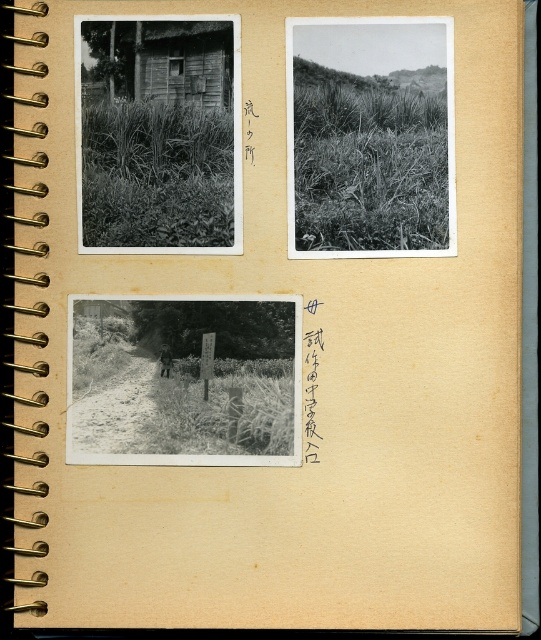
Question: Does grassy textured field at bottom center appear over wooden hut at upper left?

Choices:
 (A) no
 (B) yes

Answer: (A)

Question: Which of the following is the closest to the observer?

Choices:
 (A) grassy vegetation at upper left
 (B) grassy textured field at bottom center
 (C) wooden hut at upper left

Answer: (C)

Question: Does grassy vegetation at upper left appear under wooden hut at upper left?

Choices:
 (A) no
 (B) yes

Answer: (B)

Question: Which object is farther from the camera taking this photo?

Choices:
 (A) grassy vegetation at upper left
 (B) wooden hut at upper left

Answer: (A)

Question: Which point is farther to the camera?

Choices:
 (A) (209, 96)
 (B) (183, 369)

Answer: (B)

Question: Does grassy field at upper right have a lesser width compared to grassy textured field at bottom center?

Choices:
 (A) no
 (B) yes

Answer: (B)